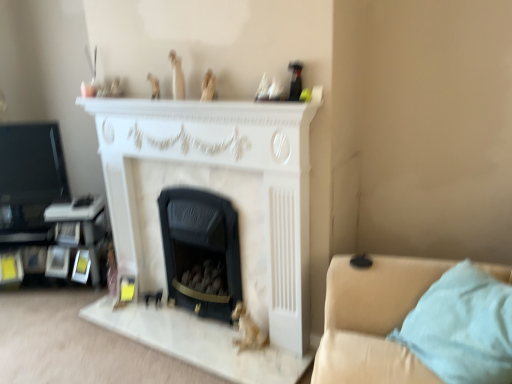
Locate an element on the screen. matte beige figurine at upper center, acting as the second toy starting from the bottom is located at coordinates (208, 86).

The width and height of the screenshot is (512, 384). Find the location of `white matte statue at upper center, the first toy positioned from the top`. white matte statue at upper center, the first toy positioned from the top is located at coordinates (177, 76).

Image resolution: width=512 pixels, height=384 pixels. Identify the location of light beige fabric studio couch at lower right. (372, 320).

What do you see at coordinates (154, 86) in the screenshot? Image resolution: width=512 pixels, height=384 pixels. I see `wooden figurine at upper center, which ranks as the 4th toy in right-to-left order` at bounding box center [154, 86].

In order to face wooden figurine at upper center, the 1th toy viewed from the left, should I rotate leftwards or rightwards?

Rotate left and turn 13.483 degrees.

At what (x,y) coordinates should I click in order to perform the action: click on white marble fireplace at center, which is the 2th fireplace from right to left. Please return your answer as a coordinate pair (x, y). Image resolution: width=512 pixels, height=384 pixels. Looking at the image, I should click on (233, 206).

The height and width of the screenshot is (384, 512). What do you see at coordinates (248, 330) in the screenshot?
I see `gold metallic figurine at lower center, acting as the 1th toy starting from the right` at bounding box center [248, 330].

You are a GUI agent. You are given a task and a screenshot of the screen. Output one action in this format:
    pyautogui.click(x=<x>, y=<y>)
    Task: Click on the matte beige figurine at upper center, acting as the second toy starting from the bottom
    The height and width of the screenshot is (384, 512).
    Given the screenshot: What is the action you would take?
    pyautogui.click(x=208, y=86)

Would you say gold metallic figurine at lower center, which is the fourth toy from top to bottom, is inside or outside white marble fireplace at center, which is the 2th fireplace from right to left?

gold metallic figurine at lower center, which is the fourth toy from top to bottom, is not inside white marble fireplace at center, which is the 2th fireplace from right to left, it's outside.

Consider the image. Measure the distance between gold metallic figurine at lower center, acting as the 1th toy starting from the right, and white marble fireplace at center, which is the 1th fireplace in left-to-right order.

They are 57.61 centimeters apart.

Is gold metallic figurine at lower center, the 1th toy ordered from the bottom, taller or shorter than white marble fireplace at center, which is the 2th fireplace from right to left?

Clearly, gold metallic figurine at lower center, the 1th toy ordered from the bottom, is shorter compared to white marble fireplace at center, which is the 2th fireplace from right to left.

Would you say gold metallic figurine at lower center, which is the fourth toy in left-to-right order, is to the left or to the right of white marble fireplace at center, which is the 2th fireplace from right to left, in the picture?

Based on their positions, gold metallic figurine at lower center, which is the fourth toy in left-to-right order, is located to the right of white marble fireplace at center, which is the 2th fireplace from right to left.

Where is `the 1st fireplace behind the light beige fabric studio couch at lower right, starting your count from the anchor`? the 1st fireplace behind the light beige fabric studio couch at lower right, starting your count from the anchor is located at coordinates (233, 206).

Based on their sizes in the image, would you say white marble fireplace at center, which is the 1th fireplace in left-to-right order, is bigger or smaller than light beige fabric studio couch at lower right?

Clearly, white marble fireplace at center, which is the 1th fireplace in left-to-right order, is larger in size than light beige fabric studio couch at lower right.

From the image's perspective, relative to light beige fabric studio couch at lower right, is white marble fireplace at center, which is the 2th fireplace from right to left, above or below?

Clearly, from the image's perspective, white marble fireplace at center, which is the 2th fireplace from right to left, is above light beige fabric studio couch at lower right.

From a real-world perspective, is white marble fireplace at center, which is the 2th fireplace from right to left, on light beige fabric studio couch at lower right?

Yes.

Considering the relative sizes of matte beige figurine at upper center, arranged as the 3th toy when viewed from the left, and light beige fabric studio couch at lower right in the image provided, is matte beige figurine at upper center, arranged as the 3th toy when viewed from the left, thinner than light beige fabric studio couch at lower right?

Yes, matte beige figurine at upper center, arranged as the 3th toy when viewed from the left, is thinner than light beige fabric studio couch at lower right.

How different are the orientations of matte beige figurine at upper center, acting as the second toy starting from the bottom, and light beige fabric studio couch at lower right in degrees?

The facing directions of matte beige figurine at upper center, acting as the second toy starting from the bottom, and light beige fabric studio couch at lower right are 40.7 degrees apart.

From a real-world perspective, which is physically below, matte beige figurine at upper center, acting as the second toy starting from the bottom, or light beige fabric studio couch at lower right?

light beige fabric studio couch at lower right, from a real-world perspective.

Which is more to the right, matte beige figurine at upper center, arranged as the 3th toy when viewed from the left, or light beige fabric studio couch at lower right?

Positioned to the right is light beige fabric studio couch at lower right.

Considering the sizes of white matte statue at upper center, the third toy positioned from the right, and white marble fireplace at center, which is the 1th fireplace in left-to-right order, in the image, is white matte statue at upper center, the third toy positioned from the right, taller or shorter than white marble fireplace at center, which is the 1th fireplace in left-to-right order,?

white matte statue at upper center, the third toy positioned from the right, is shorter than white marble fireplace at center, which is the 1th fireplace in left-to-right order.

Which is more to the left, white matte statue at upper center, the fourth toy positioned from the bottom, or white marble fireplace at center, which is the 1th fireplace in left-to-right order?

Positioned to the left is white matte statue at upper center, the fourth toy positioned from the bottom.

Is white matte statue at upper center, the first toy positioned from the top, aimed at white marble fireplace at center, which is the 1th fireplace in left-to-right order?

No, white matte statue at upper center, the first toy positioned from the top, is not facing towards white marble fireplace at center, which is the 1th fireplace in left-to-right order.

Considering the relative sizes of white matte statue at upper center, the 2th toy viewed from the left, and white marble fireplace at center, which is the 1th fireplace in left-to-right order, in the image provided, is white matte statue at upper center, the 2th toy viewed from the left, bigger than white marble fireplace at center, which is the 1th fireplace in left-to-right order,?

No, white matte statue at upper center, the 2th toy viewed from the left, is not bigger than white marble fireplace at center, which is the 1th fireplace in left-to-right order.

From a real-world perspective, does white marble fireplace at center, which is the 2th fireplace from right to left, sit lower than black matte fireplace at center, which is the second fireplace from left to right?

No, from a real-world perspective, white marble fireplace at center, which is the 2th fireplace from right to left, is not below black matte fireplace at center, which is the second fireplace from left to right.

Can you confirm if white marble fireplace at center, which is the 1th fireplace in left-to-right order, is wider than black matte fireplace at center, which is the second fireplace from left to right?

Incorrect, the width of white marble fireplace at center, which is the 1th fireplace in left-to-right order, does not surpass that of black matte fireplace at center, which is the second fireplace from left to right.

Is white marble fireplace at center, which is the 2th fireplace from right to left, to the left or to the right of black matte fireplace at center, positioned as the 1th fireplace in right-to-left order, in the image?

white marble fireplace at center, which is the 2th fireplace from right to left, is positioned on black matte fireplace at center, positioned as the 1th fireplace in right-to-left order,'s left side.

From the image's perspective, is white marble fireplace at center, which is the 2th fireplace from right to left, below black matte fireplace at center, which is the second fireplace from left to right?

No, from the image's perspective, white marble fireplace at center, which is the 2th fireplace from right to left, is not beneath black matte fireplace at center, which is the second fireplace from left to right.

Is wooden figurine at upper center, the 1th toy viewed from the left, bigger or smaller than white matte statue at upper center, the first toy positioned from the top?

In the image, wooden figurine at upper center, the 1th toy viewed from the left, appears to be smaller than white matte statue at upper center, the first toy positioned from the top.

From a real-world perspective, which is physically above, wooden figurine at upper center, the 1th toy viewed from the left, or white matte statue at upper center, the first toy positioned from the top?

white matte statue at upper center, the first toy positioned from the top, is physically above.

Is point (152, 74) closer to camera compared to point (183, 94)?

No, it is not.

Is wooden figurine at upper center, which ranks as the 4th toy in right-to-left order, facing towards white matte statue at upper center, the 2th toy viewed from the left?

No, wooden figurine at upper center, which ranks as the 4th toy in right-to-left order, is not aimed at white matte statue at upper center, the 2th toy viewed from the left.

From a real-world perspective, is wooden figurine at upper center, which appears as the 2th toy when viewed from the top, above or below light beige fabric studio couch at lower right?

In terms of real-world spatial position, wooden figurine at upper center, which appears as the 2th toy when viewed from the top, is above light beige fabric studio couch at lower right.

Looking at the image, does wooden figurine at upper center, which ranks as the 4th toy in right-to-left order, seem bigger or smaller compared to light beige fabric studio couch at lower right?

wooden figurine at upper center, which ranks as the 4th toy in right-to-left order, is smaller than light beige fabric studio couch at lower right.

From the image's perspective, between wooden figurine at upper center, the third toy positioned from the bottom, and light beige fabric studio couch at lower right, which one is located above?

wooden figurine at upper center, the third toy positioned from the bottom.

Identify the location of the 2nd fireplace above the gold metallic figurine at lower center, acting as the 1th toy starting from the right (from the image's perspective). tap(233, 206).

You are a GUI agent. You are given a task and a screenshot of the screen. Output one action in this format:
    pyautogui.click(x=<x>, y=<y>)
    Task: Click on the studio couch located in front of the white marble fireplace at center, which is the 2th fireplace from right to left
    The height and width of the screenshot is (384, 512).
    Given the screenshot: What is the action you would take?
    pyautogui.click(x=372, y=320)

From the image, which object appears to be farther from matte beige figurine at upper center, acting as the second toy starting from the right, black matte fireplace at center, which is the second fireplace from left to right, or gold metallic figurine at lower center, which is the fourth toy in left-to-right order?

gold metallic figurine at lower center, which is the fourth toy in left-to-right order.

From the image, which object appears to be nearer to wooden figurine at upper center, the third toy positioned from the bottom, matte beige figurine at upper center, arranged as the 3th toy when viewed from the left, or white marble fireplace at center, which is the 2th fireplace from right to left?

matte beige figurine at upper center, arranged as the 3th toy when viewed from the left, is positioned closer to the anchor wooden figurine at upper center, the third toy positioned from the bottom.

From the image, which object appears to be farther from wooden figurine at upper center, the third toy positioned from the bottom, matte beige figurine at upper center, acting as the second toy starting from the bottom, or black matte fireplace at center, which is the second fireplace from left to right?

The object further to wooden figurine at upper center, the third toy positioned from the bottom, is black matte fireplace at center, which is the second fireplace from left to right.

In the scene shown: Which object lies nearer to the anchor point white marble fireplace at center, which is the 2th fireplace from right to left, gold metallic figurine at lower center, the 1th toy ordered from the bottom, or black matte fireplace at center, positioned as the 1th fireplace in right-to-left order?

The object closer to white marble fireplace at center, which is the 2th fireplace from right to left, is black matte fireplace at center, positioned as the 1th fireplace in right-to-left order.

Based on their spatial positions, is white marble fireplace at center, which is the 1th fireplace in left-to-right order, or wooden figurine at upper center, which appears as the 2th toy when viewed from the top, closer to black matte fireplace at center, positioned as the 1th fireplace in right-to-left order?

white marble fireplace at center, which is the 1th fireplace in left-to-right order.

Which object lies nearer to the anchor point matte beige figurine at upper center, which is the 3th toy in top-to-bottom order, light beige fabric studio couch at lower right or gold metallic figurine at lower center, which is the fourth toy from top to bottom?

gold metallic figurine at lower center, which is the fourth toy from top to bottom, lies closer to matte beige figurine at upper center, which is the 3th toy in top-to-bottom order, than the other object.

When comparing their distances from black matte fireplace at center, positioned as the 1th fireplace in right-to-left order, does matte beige figurine at upper center, which is the 3th toy in top-to-bottom order, or light beige fabric studio couch at lower right seem closer?

light beige fabric studio couch at lower right is positioned closer to the anchor black matte fireplace at center, positioned as the 1th fireplace in right-to-left order.

When comparing their distances from black matte fireplace at center, positioned as the 1th fireplace in right-to-left order, does light beige fabric studio couch at lower right or white marble fireplace at center, which is the 1th fireplace in left-to-right order, seem closer?

white marble fireplace at center, which is the 1th fireplace in left-to-right order, is positioned closer to the anchor black matte fireplace at center, positioned as the 1th fireplace in right-to-left order.

Locate an element on the screen. studio couch between wooden figurine at upper center, which appears as the 2th toy when viewed from the top, and gold metallic figurine at lower center, which is the fourth toy in left-to-right order, in the vertical direction is located at coordinates (372, 320).

Locate an element on the screen. Image resolution: width=512 pixels, height=384 pixels. fireplace between white marble fireplace at center, which is the 1th fireplace in left-to-right order, and gold metallic figurine at lower center, the 1th toy ordered from the bottom, in the up-down direction is located at coordinates (200, 248).

Locate an element on the screen. This screenshot has width=512, height=384. fireplace between white matte statue at upper center, the 2th toy viewed from the left, and black matte fireplace at center, positioned as the 1th fireplace in right-to-left order, in the vertical direction is located at coordinates (233, 206).

The image size is (512, 384). In order to click on toy that lies between wooden figurine at upper center, the third toy positioned from the bottom, and black matte fireplace at center, which is the second fireplace from left to right, from top to bottom in this screenshot , I will do `click(208, 86)`.